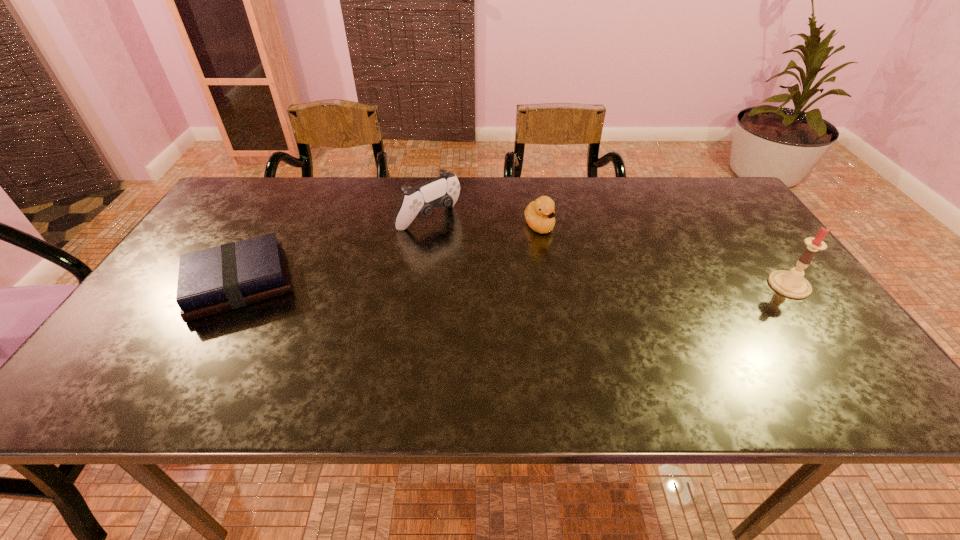
Identify the location of free point located 0.370m on the front-facing side of the control. Image resolution: width=960 pixels, height=540 pixels. (545, 304).

You are a GUI agent. You are given a task and a screenshot of the screen. Output one action in this format:
    pyautogui.click(x=<x>, y=<y>)
    Task: Click on the free space located on the front-facing side of the control
    The height and width of the screenshot is (540, 960).
    Given the screenshot: What is the action you would take?
    pyautogui.click(x=502, y=272)

Where is `vacant space positioned on the front-facing side of the control`? vacant space positioned on the front-facing side of the control is located at coordinates (513, 280).

Locate an element on the screen. vacant area located facing forward on the third object from left to right is located at coordinates (613, 317).

Locate an element on the screen. The width and height of the screenshot is (960, 540). free space located facing forward on the third object from left to right is located at coordinates (601, 302).

The image size is (960, 540). What are the coordinates of `vacant position located 0.080m facing forward on the third object from left to right` in the screenshot? It's located at (562, 255).

Identify the location of control present at the far edge. The image size is (960, 540). (443, 191).

I want to click on duckling located at the far edge, so click(539, 214).

The height and width of the screenshot is (540, 960). Find the location of `object that is at the left edge`. object that is at the left edge is located at coordinates (233, 275).

In order to click on object positioned at the right edge in this screenshot , I will do `click(792, 283)`.